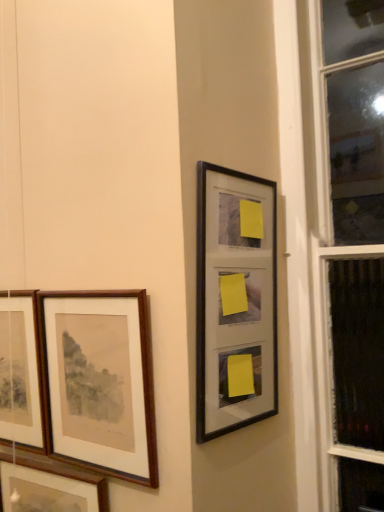
Question: From a real-world perspective, relative to wooden picture frame at left, the first picture frame from the left, is wooden frame at left, placed as the 3th picture frame when sorted from left to right, vertically above or below?

Choices:
 (A) below
 (B) above

Answer: (A)

Question: From the image's perspective, is wooden frame at left, placed as the second picture frame when sorted from right to left, above or below wooden picture frame at left, arranged as the fourth picture frame when viewed from the right?

Choices:
 (A) above
 (B) below

Answer: (A)

Question: Considering the real-world distances, which object is farthest from the wooden picture frame at left, the first picture frame from the left?

Choices:
 (A) wooden framed picture at left, positioned as the 3th picture frame in right-to-left order
 (B) wooden frame at left, placed as the second picture frame when sorted from right to left
 (C) black matte picture frame at upper right, which is counted as the 1th picture frame, starting from the right

Answer: (C)

Question: Based on their relative distances, which object is farther from the wooden frame at left, placed as the second picture frame when sorted from right to left?

Choices:
 (A) wooden framed picture at left, positioned as the 3th picture frame in right-to-left order
 (B) black matte picture frame at upper right, which is counted as the 1th picture frame, starting from the right
 (C) wooden picture frame at left, the first picture frame from the left

Answer: (B)